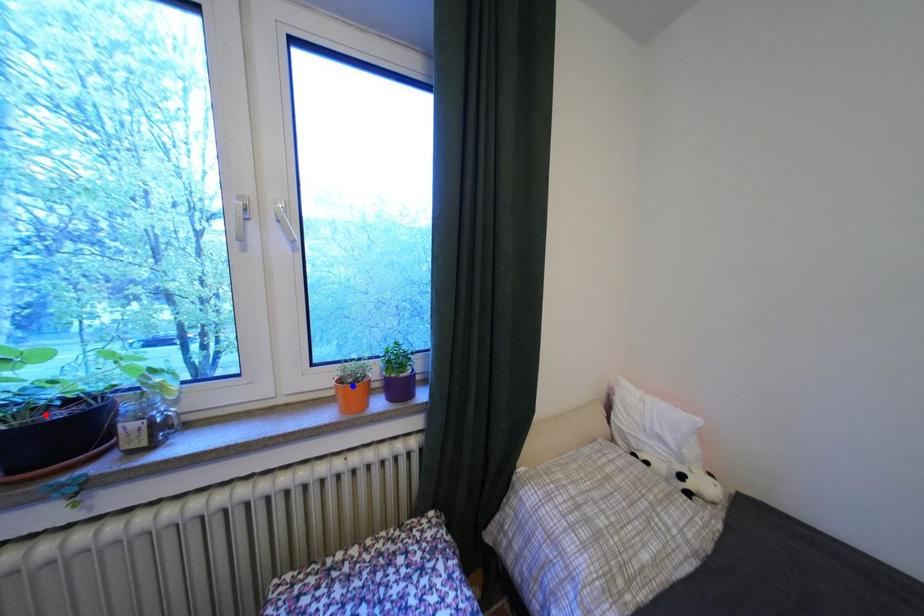
Question: Which of the two points in the image is closer to the camera?

Choices:
 (A) Blue point is closer.
 (B) Red point is closer.

Answer: (B)